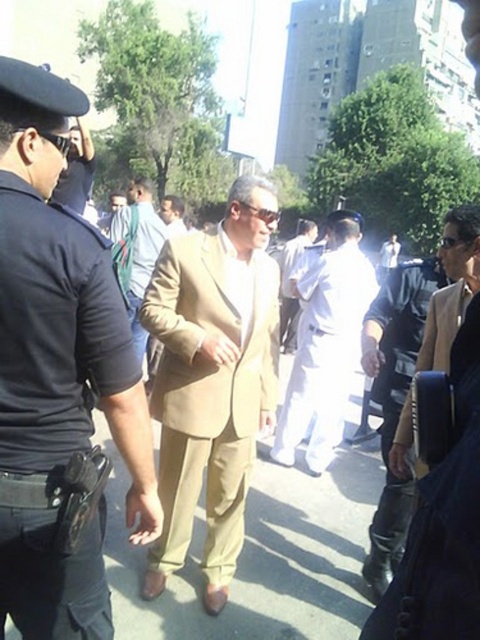
You are a fashion designer observing two people in the scene. One is wearing a tan fabric suit at center and the other is wearing a light brown suit at center. Which one is standing more to the right?

The tan fabric suit at center is positioned on the right side of light brown suit at center, so the person wearing the tan fabric suit at center is standing more to the right.